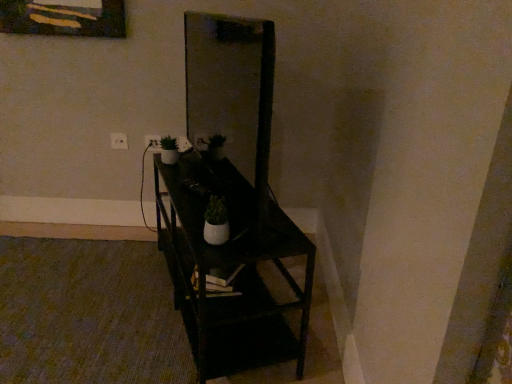
Question: Is white plastic electric outlet at upper center, the second electric outlet viewed from the left, behind matte glass mirror at center?

Choices:
 (A) no
 (B) yes

Answer: (B)

Question: From the image's perspective, does white plastic electric outlet at upper center, which appears as the 1th electric outlet when viewed from the right, appear higher than matte glass mirror at center?

Choices:
 (A) yes
 (B) no

Answer: (B)

Question: From the image's perspective, is white plastic electric outlet at upper center, which appears as the 1th electric outlet when viewed from the right, located beneath matte glass mirror at center?

Choices:
 (A) yes
 (B) no

Answer: (A)

Question: Does white plastic electric outlet at upper center, the second electric outlet viewed from the left, have a smaller size compared to matte glass mirror at center?

Choices:
 (A) no
 (B) yes

Answer: (B)

Question: Is white plastic electric outlet at upper center, the second electric outlet viewed from the left, at the left side of matte glass mirror at center?

Choices:
 (A) yes
 (B) no

Answer: (A)

Question: Considering the relative sizes of white plastic electric outlet at upper center, which appears as the 1th electric outlet when viewed from the right, and matte glass mirror at center in the image provided, is white plastic electric outlet at upper center, which appears as the 1th electric outlet when viewed from the right, wider than matte glass mirror at center?

Choices:
 (A) yes
 (B) no

Answer: (B)

Question: From a real-world perspective, is black matte shelf at center positioned under matte glass mirror at center based on gravity?

Choices:
 (A) no
 (B) yes

Answer: (B)

Question: From a real-world perspective, is black matte shelf at center positioned over matte glass mirror at center based on gravity?

Choices:
 (A) no
 (B) yes

Answer: (A)

Question: Is black matte shelf at center closer to camera compared to matte glass mirror at center?

Choices:
 (A) yes
 (B) no

Answer: (B)

Question: Is black matte shelf at center facing towards matte glass mirror at center?

Choices:
 (A) yes
 (B) no

Answer: (B)

Question: Is black matte shelf at center with matte glass mirror at center?

Choices:
 (A) yes
 (B) no

Answer: (B)

Question: Does black matte shelf at center have a larger size compared to matte glass mirror at center?

Choices:
 (A) no
 (B) yes

Answer: (B)

Question: Does white plastic electric outlet at upper center, the second electric outlet viewed from the left, come behind black matte shelf at center?

Choices:
 (A) no
 (B) yes

Answer: (B)